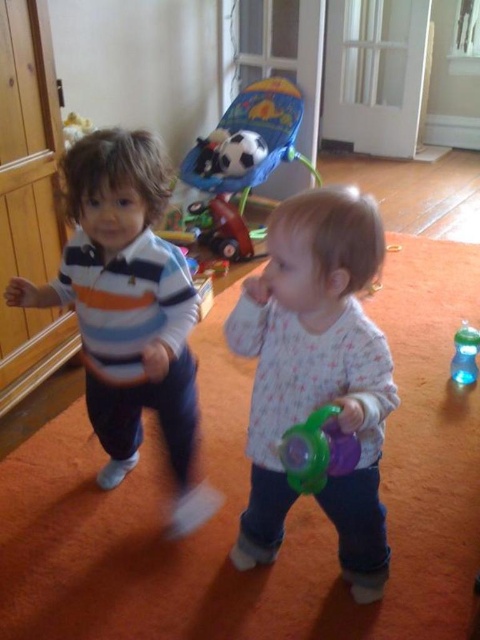
Is translucent green sippy cup at center wider than wooden toy car at center?

Incorrect, translucent green sippy cup at center's width does not surpass wooden toy car at center's.

Based on the photo, which is more to the left, translucent green sippy cup at center or wooden toy car at center?

wooden toy car at center

This screenshot has height=640, width=480. In order to click on translucent green sippy cup at center in this screenshot , I will do `click(317, 451)`.

Between point (103, 321) and point (225, 216), which one is positioned behind?

The point (225, 216) is behind.

Between striped cotton shirt at center and wooden toy car at center, which one is positioned lower?

striped cotton shirt at center is below.

Identify the location of striped cotton shirt at center. (129, 310).

Who is lower down, wooden toy car at center or transparent plastic sippy cup at lower right?

transparent plastic sippy cup at lower right

Which of these two, wooden toy car at center or transparent plastic sippy cup at lower right, stands taller?

A: wooden toy car at center is taller.

Does point (219, 204) come in front of point (477, 371)?

No, (219, 204) is behind (477, 371).

At what (x,y) coordinates should I click in order to perform the action: click on wooden toy car at center. Please return your answer as a coordinate pair (x, y). This screenshot has width=480, height=640. Looking at the image, I should click on (224, 228).